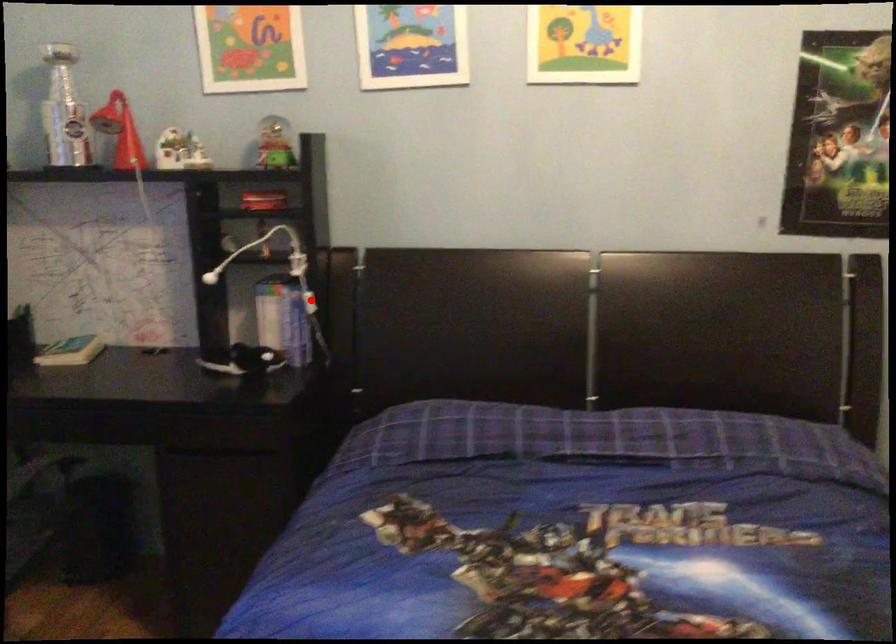
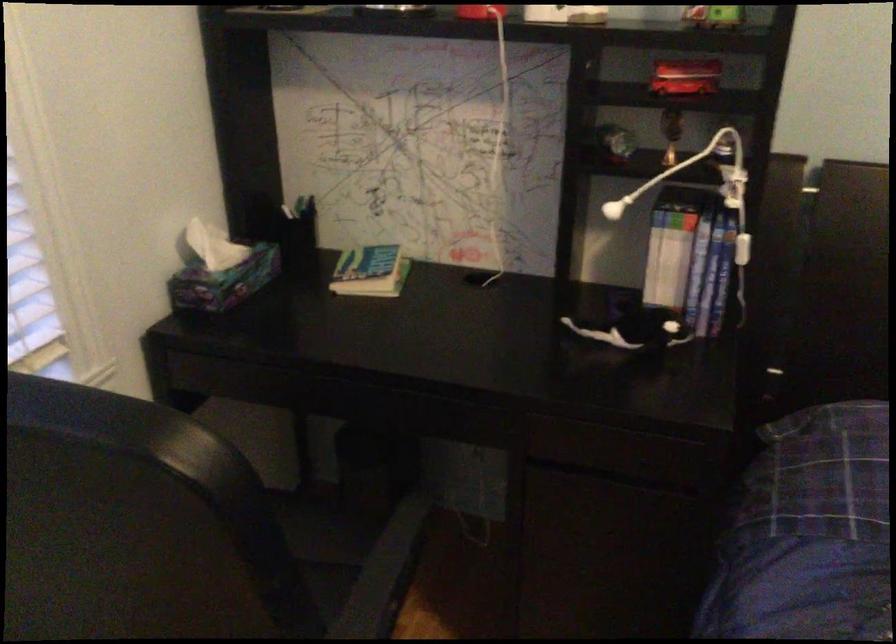
Find the pixel in the second image that matches the highlighted location in the first image.

(742, 249)